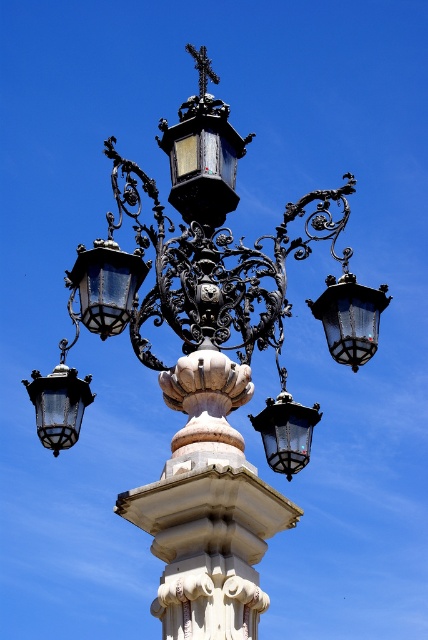
You are standing directly in front of the streetlamp. Which direction should you look to see the clear glass lantern at upper right?

You should look to the upper right direction to see the clear glass lantern at upper right as it is located at point (350, 316) which is in the upper right quadrant of the image.

You are an artist trying to sketch the decorative streetlamp. You want to place the matte black lantern at upper left in your drawing. What are the coordinates where you should position it?

The coordinates for the matte black lantern at upper left are at point (104, 285).

You are a maintenance worker needing to replace a bulb in one of the lanterns. You have a ladder that extends to 8 meters. Which lantern can you reach without moving the ladder? The scene includes a matte black lantern at upper left and a matte black lantern at center.

The matte black lantern at center is closer than the matte black lantern at upper left, which is 8.71 meters away. Since the ladder only reaches 8 meters, you can only safely reach the matte black lantern at center.